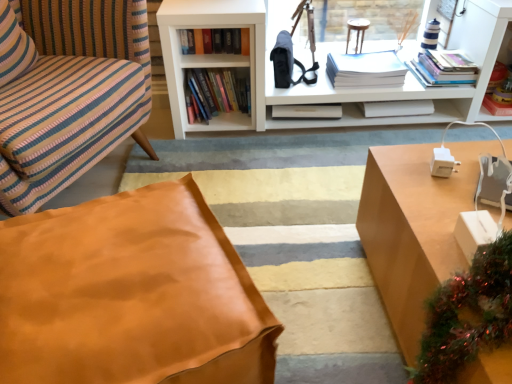
Find the location of a particular element. free space above leather ottoman at center (from a real-world perspective) is located at coordinates (93, 298).